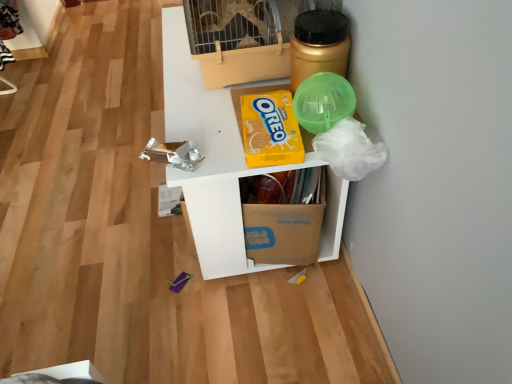
Question: Considering the relative positions of white cardboard box at upper center and yellow cardboard oreo at upper center in the image provided, is white cardboard box at upper center to the left of yellow cardboard oreo at upper center from the viewer's perspective?

Choices:
 (A) no
 (B) yes

Answer: (B)

Question: From a real-world perspective, is white cardboard box at upper center under yellow cardboard oreo at upper center?

Choices:
 (A) no
 (B) yes

Answer: (B)

Question: Is white cardboard box at upper center wider than yellow cardboard oreo at upper center?

Choices:
 (A) no
 (B) yes

Answer: (B)

Question: Is white cardboard box at upper center closer to the viewer compared to yellow cardboard oreo at upper center?

Choices:
 (A) yes
 (B) no

Answer: (B)

Question: Is yellow cardboard oreo at upper center inside white cardboard box at upper center?

Choices:
 (A) no
 (B) yes

Answer: (A)

Question: From a real-world perspective, is white cardboard box at upper center located higher than yellow cardboard oreo at upper center?

Choices:
 (A) yes
 (B) no

Answer: (B)

Question: Can you confirm if gold metallic jar at upper right is positioned to the right of brown cardboard box at center?

Choices:
 (A) no
 (B) yes

Answer: (B)

Question: Is gold metallic jar at upper right touching brown cardboard box at center?

Choices:
 (A) no
 (B) yes

Answer: (A)

Question: From a real-world perspective, does gold metallic jar at upper right stand above brown cardboard box at center?

Choices:
 (A) yes
 (B) no

Answer: (A)

Question: Is gold metallic jar at upper right bigger than brown cardboard box at center?

Choices:
 (A) yes
 (B) no

Answer: (B)

Question: Is there a large distance between gold metallic jar at upper right and brown cardboard box at center?

Choices:
 (A) yes
 (B) no

Answer: (B)

Question: Is gold metallic jar at upper right looking in the opposite direction of brown cardboard box at center?

Choices:
 (A) no
 (B) yes

Answer: (A)

Question: Considering the relative sizes of beige plastic birdcage at upper center and yellow cardboard oreo at upper center in the image provided, is beige plastic birdcage at upper center taller than yellow cardboard oreo at upper center?

Choices:
 (A) no
 (B) yes

Answer: (B)